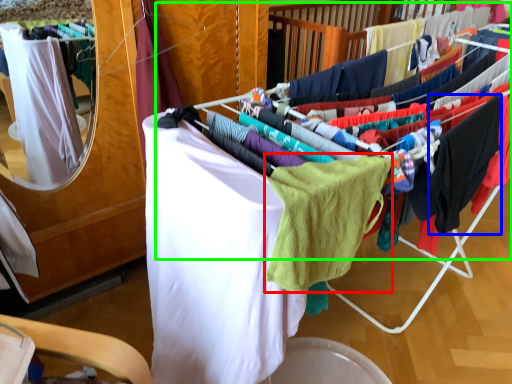
Question: Estimate the real-world distances between objects in this image. Which object is closer to baby clothe (highlighted by a red box), clothing (highlighted by a blue box) or closet (highlighted by a green box)?

Choices:
 (A) clothing
 (B) closet

Answer: (A)